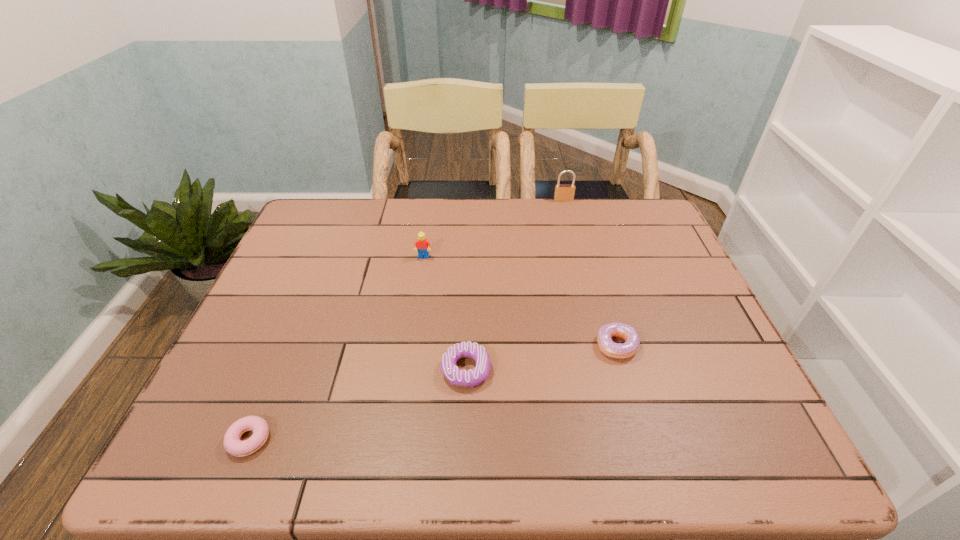
Find the location of a particular element. This screenshot has height=540, width=960. free space that satisfies the following two spatial constraints: 1. on the front-facing side of the rightmost doughnut; 2. on the left side of the farthest object is located at coordinates (601, 345).